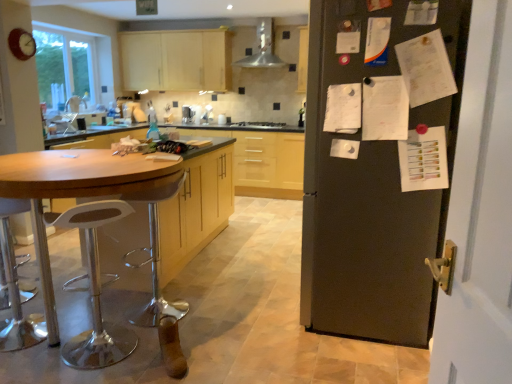
Identify the location of free space to the back side of white plastic bar stool at left, the second bar stool in the back-to-front sequence. The image size is (512, 384). (98, 318).